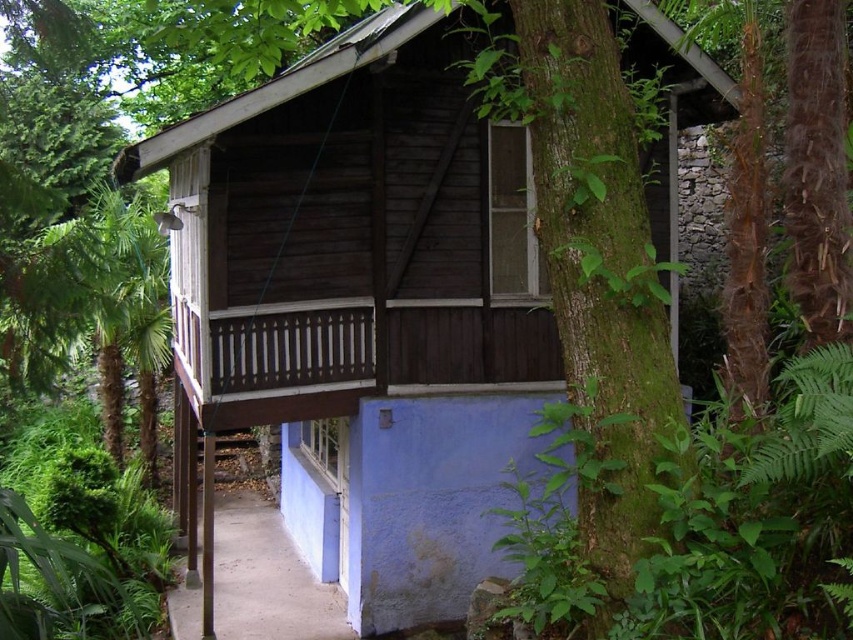
Is wooden cabin at center positioned before green leafy tree at left?

No, wooden cabin at center is behind green leafy tree at left.

In the scene shown: Between wooden cabin at center and green leafy tree at left, which one has less height?

Standing shorter between the two is green leafy tree at left.

Describe the element at coordinates (366, 305) in the screenshot. I see `wooden cabin at center` at that location.

Where is `wooden cabin at center`? wooden cabin at center is located at coordinates (366, 305).

From the picture: Who is lower down, wooden cabin at center or brown concrete path at lower center?

Positioned lower is brown concrete path at lower center.

Is wooden cabin at center smaller than brown concrete path at lower center?

Incorrect, wooden cabin at center is not smaller in size than brown concrete path at lower center.

Locate an element on the screen. wooden cabin at center is located at coordinates (366, 305).

Where is `wooden cabin at center`? The width and height of the screenshot is (853, 640). wooden cabin at center is located at coordinates (366, 305).

Does green leafy tree at left appear over brown concrete path at lower center?

Yes, green leafy tree at left is above brown concrete path at lower center.

Does point (146, 362) come behind point (277, 529)?

That is False.

Describe the element at coordinates (100, 305) in the screenshot. The image size is (853, 640). I see `green leafy tree at left` at that location.

Image resolution: width=853 pixels, height=640 pixels. In order to click on green leafy tree at left in this screenshot , I will do coord(100,305).